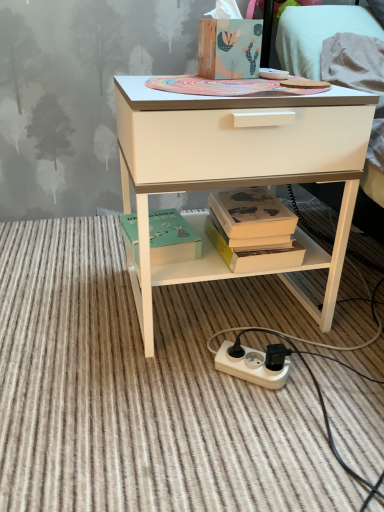
Question: Does hardcover book at center have a greater width compared to wooden tissue box at upper center, the first box viewed from the top?

Choices:
 (A) no
 (B) yes

Answer: (B)

Question: Is hardcover book at center outside wooden tissue box at upper center, the first box viewed from the top?

Choices:
 (A) no
 (B) yes

Answer: (B)

Question: Can you confirm if hardcover book at center is bigger than wooden tissue box at upper center, positioned as the first box in right-to-left order?

Choices:
 (A) yes
 (B) no

Answer: (A)

Question: From the image's perspective, is hardcover book at center beneath wooden tissue box at upper center, the first box viewed from the top?

Choices:
 (A) yes
 (B) no

Answer: (A)

Question: From a real-world perspective, does hardcover book at center sit lower than wooden tissue box at upper center, positioned as the first box in right-to-left order?

Choices:
 (A) yes
 (B) no

Answer: (A)

Question: In terms of height, does white plastic power outlet at lower center look taller or shorter compared to wooden tissue box at upper center, the second box from the bottom?

Choices:
 (A) tall
 (B) short

Answer: (B)

Question: From a real-world perspective, relative to wooden tissue box at upper center, placed as the 2th box when sorted from left to right, is white plastic power outlet at lower center vertically above or below?

Choices:
 (A) below
 (B) above

Answer: (A)

Question: Based on their positions, is white plastic power outlet at lower center located to the left or right of wooden tissue box at upper center, the second box from the bottom?

Choices:
 (A) left
 (B) right

Answer: (B)

Question: Is white plastic power outlet at lower center inside or outside of wooden tissue box at upper center, the second box from the bottom?

Choices:
 (A) outside
 (B) inside

Answer: (A)

Question: Is hardcover book at center wider or thinner than white matte desk at center?

Choices:
 (A) wide
 (B) thin

Answer: (B)

Question: Based on their sizes in the image, would you say hardcover book at center is bigger or smaller than white matte desk at center?

Choices:
 (A) small
 (B) big

Answer: (A)

Question: Is hardcover book at center inside the boundaries of white matte desk at center, or outside?

Choices:
 (A) outside
 (B) inside

Answer: (B)

Question: Is point (297, 263) positioned closer to the camera than point (339, 168)?

Choices:
 (A) closer
 (B) farther

Answer: (B)

Question: Is green matte box at lower center, the 2th box viewed from the top, to the left or to the right of white plastic power strip at lower center in the image?

Choices:
 (A) left
 (B) right

Answer: (A)

Question: From the image's perspective, is green matte box at lower center, arranged as the second box when viewed from the right, above or below white plastic power strip at lower center?

Choices:
 (A) below
 (B) above

Answer: (B)